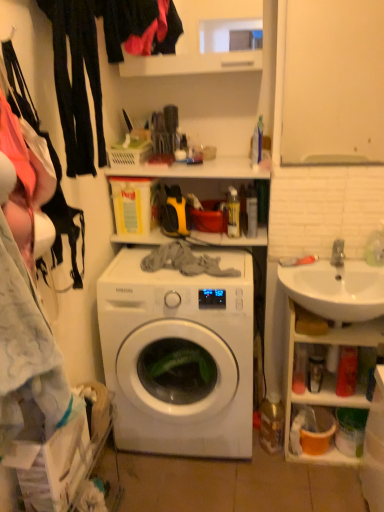
Question: In the image, is white glossy washing machine at center on the left side or the right side of matte black fabric at upper left?

Choices:
 (A) left
 (B) right

Answer: (B)

Question: In the image, is white glossy washing machine at center positioned in front of or behind matte black fabric at upper left?

Choices:
 (A) front
 (B) behind

Answer: (B)

Question: Estimate the real-world distances between objects in this image. Which object is farther from the white glossy sink at lower right?

Choices:
 (A) white glossy washing machine at center
 (B) matte black fabric at upper left
 (C) white ceramic sink at right

Answer: (B)

Question: Which of these objects is positioned farthest from the white glossy washing machine at center?

Choices:
 (A) white glossy sink at lower right
 (B) white ceramic sink at right
 (C) matte black fabric at upper left

Answer: (C)